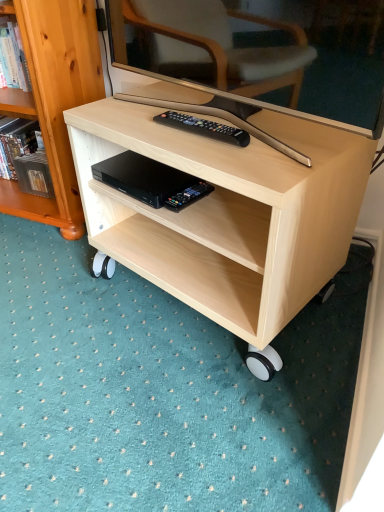
Locate an element on the screen. This screenshot has height=512, width=384. empty space that is ontop of light wood desk at center (from a real-world perspective) is located at coordinates [x=234, y=117].